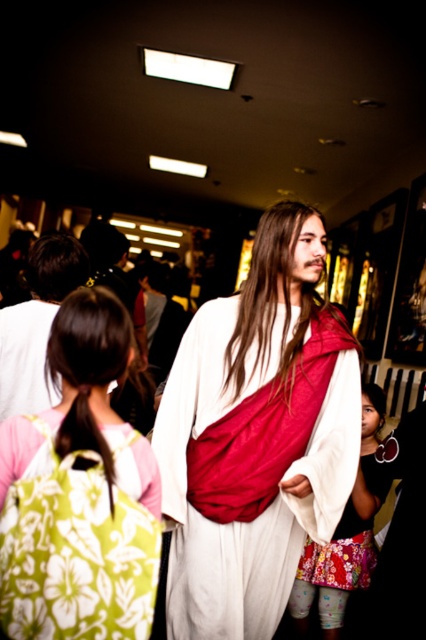
In the scene shown: Does floral fabric skirt at lower center have a smaller size compared to white cloth at center?

Actually, floral fabric skirt at lower center might be larger than white cloth at center.

Does point (336, 556) lie behind point (8, 352)?

That is True.

Where is `floral fabric skirt at lower center`? floral fabric skirt at lower center is located at coordinates (345, 536).

Based on the photo, who is more distant from viewer, (83, 461) or (80, 256)?

The point (80, 256) is behind.

Is green floral backpack at lower left bigger than white cloth at center?

Incorrect, green floral backpack at lower left is not larger than white cloth at center.

At what (x,y) coordinates should I click in order to perform the action: click on green floral backpack at lower left. Please return your answer as a coordinate pair (x, y). Image resolution: width=426 pixels, height=640 pixels. Looking at the image, I should click on (x=80, y=492).

Is green floral backpack at lower left wider than floral fabric skirt at lower center?

In fact, green floral backpack at lower left might be narrower than floral fabric skirt at lower center.

Who is shorter, green floral backpack at lower left or floral fabric skirt at lower center?

Standing shorter between the two is green floral backpack at lower left.

Is point (109, 304) less distant than point (365, 508)?

That is True.

This screenshot has height=640, width=426. Identify the location of green floral backpack at lower left. tap(80, 492).